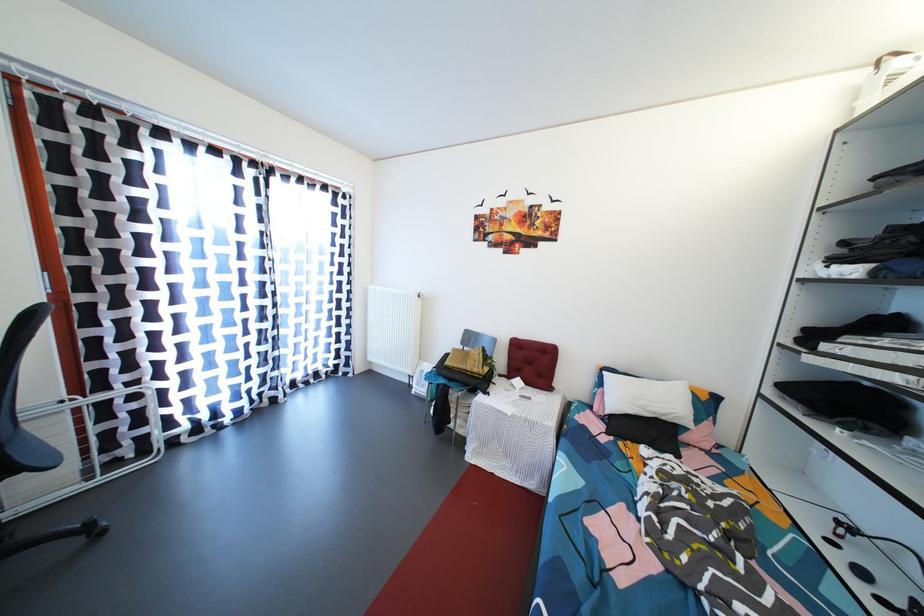
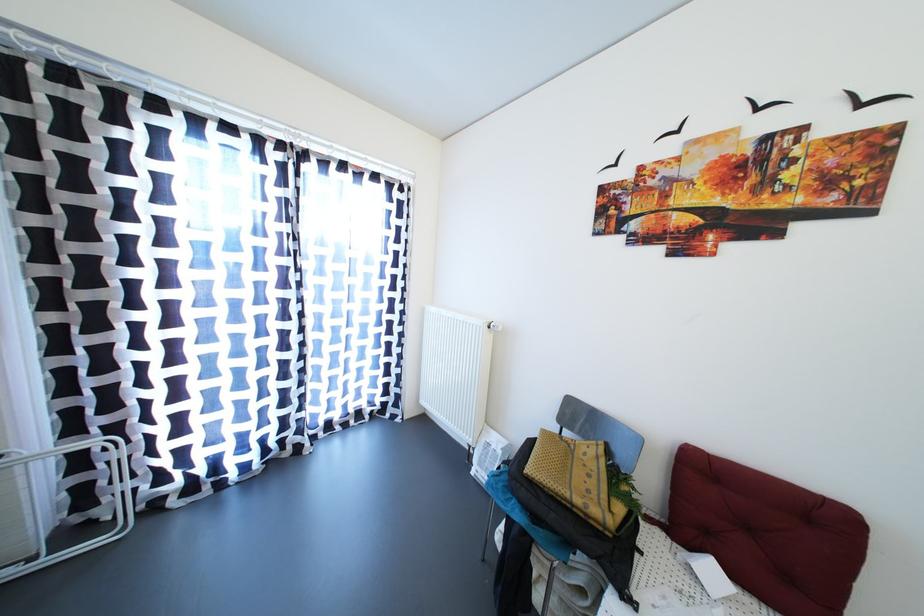
Question: I am providing you with two images of the same scene from different viewpoints. Please identify which objects are invisible in image2.

Choices:
 (A) red tufted cushion
 (B) white radiator knob
 (C) yellow patterned bag
 (D) none of these

Answer: (D)